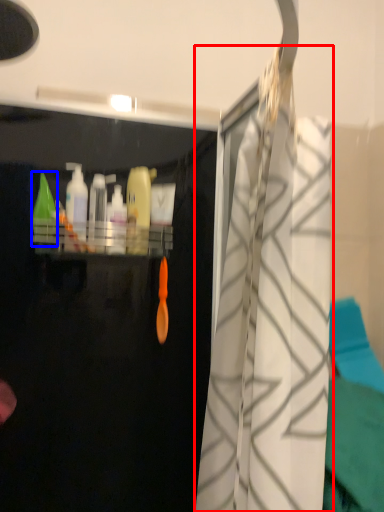
Question: Which object appears farthest to the camera in this image, curtain (highlighted by a red box) or cleaning product (highlighted by a blue box)?

Choices:
 (A) curtain
 (B) cleaning product

Answer: (B)